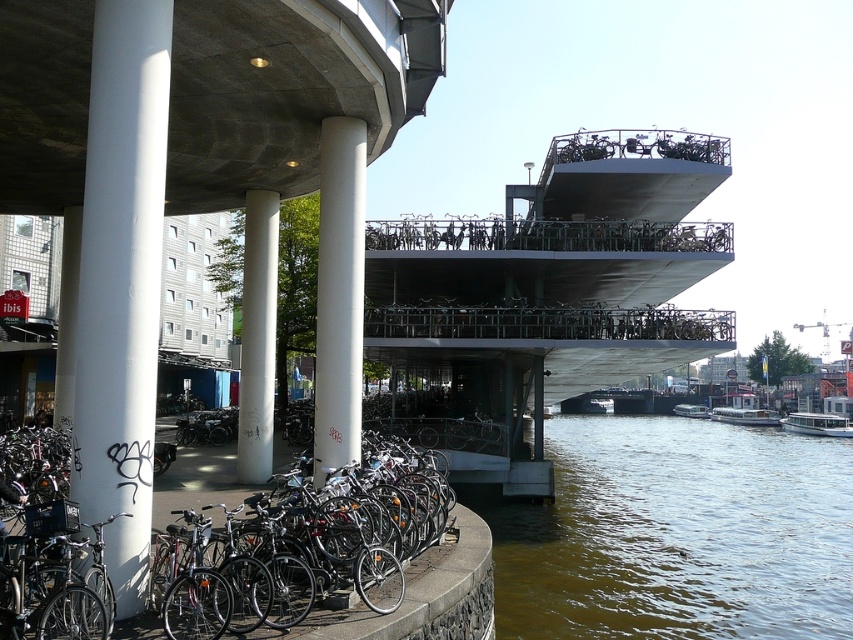
Which is more to the right, white smooth concrete pillar at center or white concrete column at center?

white smooth concrete pillar at center

Locate an element on the screen. This screenshot has height=640, width=853. white smooth concrete pillar at center is located at coordinates (339, 294).

This screenshot has height=640, width=853. What do you see at coordinates (339, 294) in the screenshot?
I see `white smooth concrete pillar at center` at bounding box center [339, 294].

This screenshot has width=853, height=640. I want to click on white smooth concrete pillar at center, so click(339, 294).

Who is positioned more to the left, concrete at upper center or white concrete column at center?

Positioned to the left is concrete at upper center.

Can you confirm if concrete at upper center is wider than white concrete column at center?

Correct, the width of concrete at upper center exceeds that of white concrete column at center.

Identify the location of concrete at upper center. (288, 88).

Between greenish water at lower right and white smooth concrete pillar at center, which one has more height?

greenish water at lower right

Which is more to the right, greenish water at lower right or white smooth concrete pillar at center?

From the viewer's perspective, greenish water at lower right appears more on the right side.

Image resolution: width=853 pixels, height=640 pixels. Describe the element at coordinates (677, 532) in the screenshot. I see `greenish water at lower right` at that location.

At what (x,y) coordinates should I click in order to perform the action: click on greenish water at lower right. Please return your answer as a coordinate pair (x, y). The height and width of the screenshot is (640, 853). Looking at the image, I should click on (677, 532).